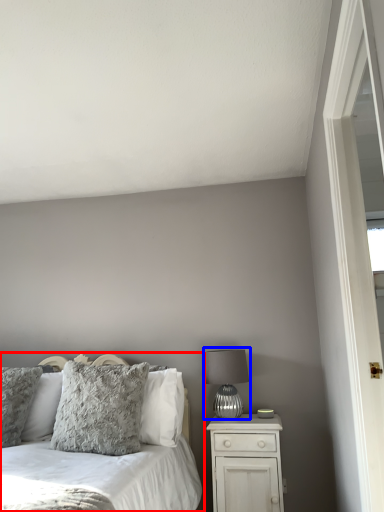
Question: Which object appears closest to the camera in this image, bed (highlighted by a red box) or table lamp (highlighted by a blue box)?

Choices:
 (A) bed
 (B) table lamp

Answer: (A)